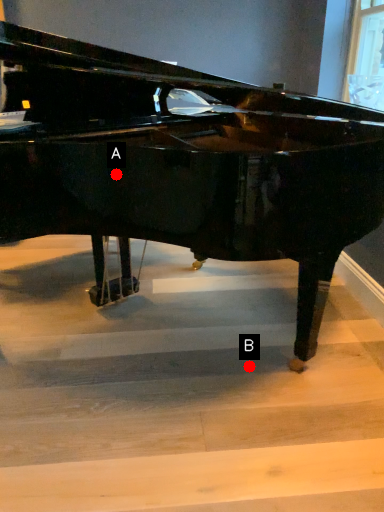
Question: Two points are circled on the image, labeled by A and B beside each circle. Which point is farther from the camera taking this photo?

Choices:
 (A) A is further
 (B) B is further

Answer: (A)